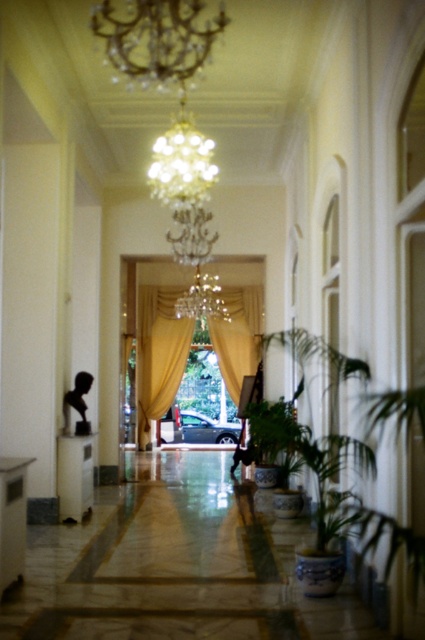
Is silky yellow curtain at center taller than crystal glass chandelier at center?

Yes, silky yellow curtain at center is taller than crystal glass chandelier at center.

Measure the distance between silky yellow curtain at center and camera.

silky yellow curtain at center is 14.70 meters from camera.

The width and height of the screenshot is (425, 640). Find the location of `silky yellow curtain at center`. silky yellow curtain at center is located at coordinates (158, 353).

You are a GUI agent. You are given a task and a screenshot of the screen. Output one action in this format:
    pyautogui.click(x=<x>, y=<y>)
    Task: Click on the silky yellow curtain at center
    The image size is (425, 640).
    Given the screenshot: What is the action you would take?
    pyautogui.click(x=158, y=353)

Is silky beige curtain at center wider than crystal glass chandelier at center?

Incorrect, silky beige curtain at center's width does not surpass crystal glass chandelier at center's.

Locate an element on the screen. The height and width of the screenshot is (640, 425). silky beige curtain at center is located at coordinates (238, 336).

Measure the distance between crystal glass chandelier at upper center and silky beige curtain at center.

The distance of crystal glass chandelier at upper center from silky beige curtain at center is 10.60 meters.

Can you confirm if crystal glass chandelier at upper center is shorter than silky beige curtain at center?

Indeed, crystal glass chandelier at upper center has a lesser height compared to silky beige curtain at center.

At what (x,y) coordinates should I click in order to perform the action: click on crystal glass chandelier at upper center. Please return your answer as a coordinate pair (x, y). This screenshot has height=640, width=425. Looking at the image, I should click on (155, 36).